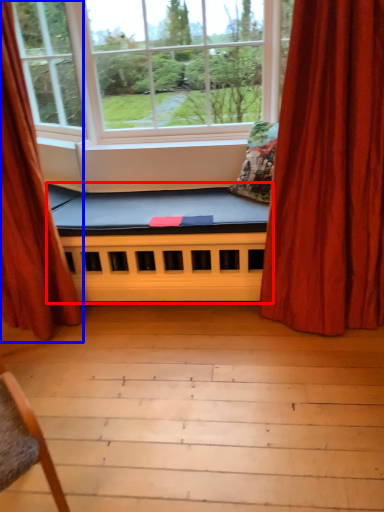
Question: Which of the following is the farthest to the observer, futon (highlighted by a red box) or curtain (highlighted by a blue box)?

Choices:
 (A) futon
 (B) curtain

Answer: (A)